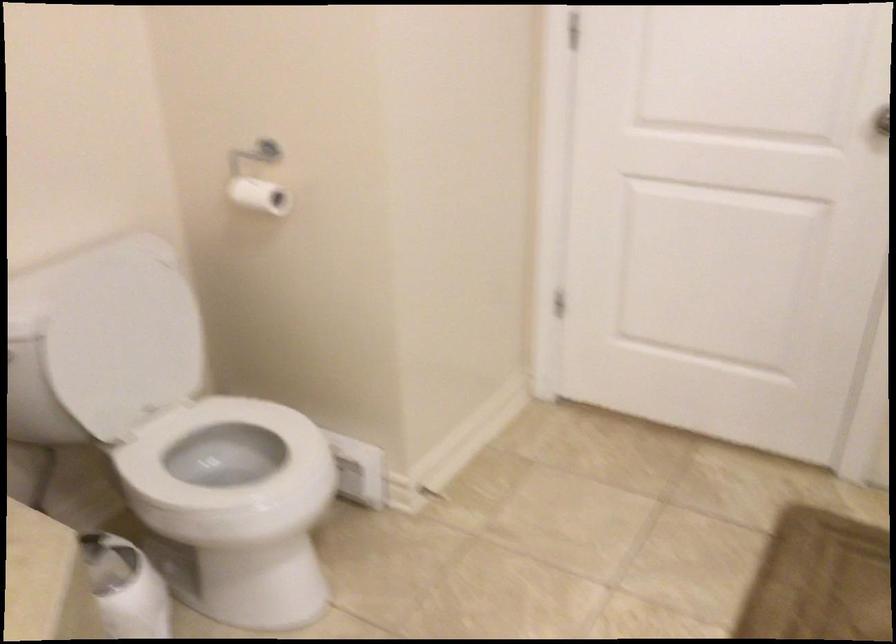
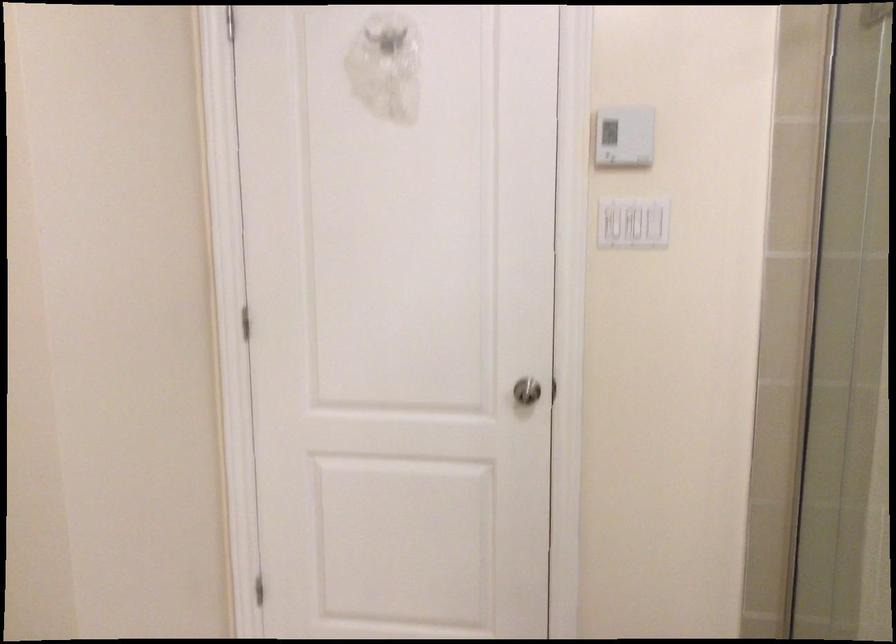
Question: In a continuous first-person perspective shot, in which direction is the camera moving?

Choices:
 (A) Left
 (B) Right
 (C) Forward
 (D) Backward

Answer: (D)